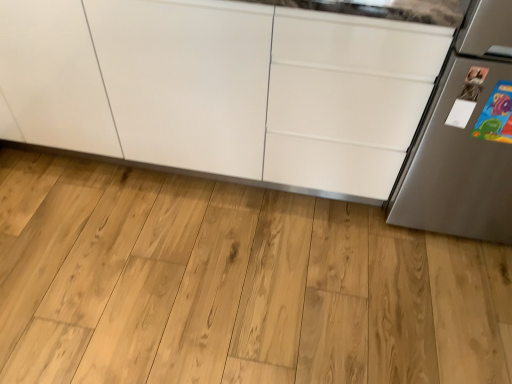
Question: Can you confirm if satin silver refrigerator at right is taller than natural wood flooring at center?

Choices:
 (A) no
 (B) yes

Answer: (B)

Question: Considering the relative sizes of satin silver refrigerator at right and natural wood flooring at center in the image provided, is satin silver refrigerator at right shorter than natural wood flooring at center?

Choices:
 (A) no
 (B) yes

Answer: (A)

Question: Are satin silver refrigerator at right and natural wood flooring at center beside each other?

Choices:
 (A) yes
 (B) no

Answer: (B)

Question: Can you confirm if satin silver refrigerator at right is positioned to the left of natural wood flooring at center?

Choices:
 (A) yes
 (B) no

Answer: (B)

Question: Is satin silver refrigerator at right surrounding natural wood flooring at center?

Choices:
 (A) no
 (B) yes

Answer: (A)

Question: Is satin silver refrigerator at right not within natural wood flooring at center?

Choices:
 (A) no
 (B) yes

Answer: (B)

Question: Is white glossy cabinet at center located within satin silver refrigerator at right?

Choices:
 (A) no
 (B) yes

Answer: (A)

Question: Considering the relative positions of satin silver refrigerator at right and white glossy cabinet at center in the image provided, is satin silver refrigerator at right to the left of white glossy cabinet at center from the viewer's perspective?

Choices:
 (A) yes
 (B) no

Answer: (B)

Question: Can you confirm if satin silver refrigerator at right is taller than white glossy cabinet at center?

Choices:
 (A) yes
 (B) no

Answer: (A)

Question: Are satin silver refrigerator at right and white glossy cabinet at center beside each other?

Choices:
 (A) yes
 (B) no

Answer: (B)

Question: Considering the relative sizes of satin silver refrigerator at right and white glossy cabinet at center in the image provided, is satin silver refrigerator at right thinner than white glossy cabinet at center?

Choices:
 (A) yes
 (B) no

Answer: (A)

Question: Considering the relative sizes of satin silver refrigerator at right and white glossy cabinet at center in the image provided, is satin silver refrigerator at right bigger than white glossy cabinet at center?

Choices:
 (A) yes
 (B) no

Answer: (B)

Question: Is white glossy cabinet at center outside natural wood flooring at center?

Choices:
 (A) no
 (B) yes

Answer: (B)